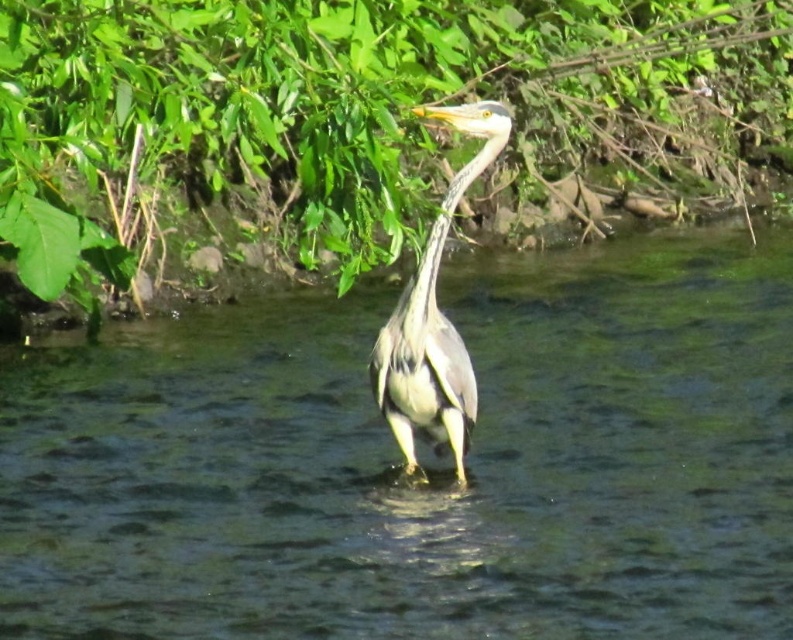
You are a photographer trying to capture the heron in the image. You notice the clear water at center and the green leafy vegetation at upper center. Which of these two elements should you focus on if you want to highlight the larger area in your composition?

The green leafy vegetation at upper center is larger than the clear water at center, so focusing on it would highlight the larger area in your composition.

You are a birdwatcher observing the heron in the image. You notice the green leafy vegetation at upper center and the gray matte neck at upper center. Which of these two objects appears larger in the image?

The green leafy vegetation at upper center appears larger than the gray matte neck at upper center in the image.